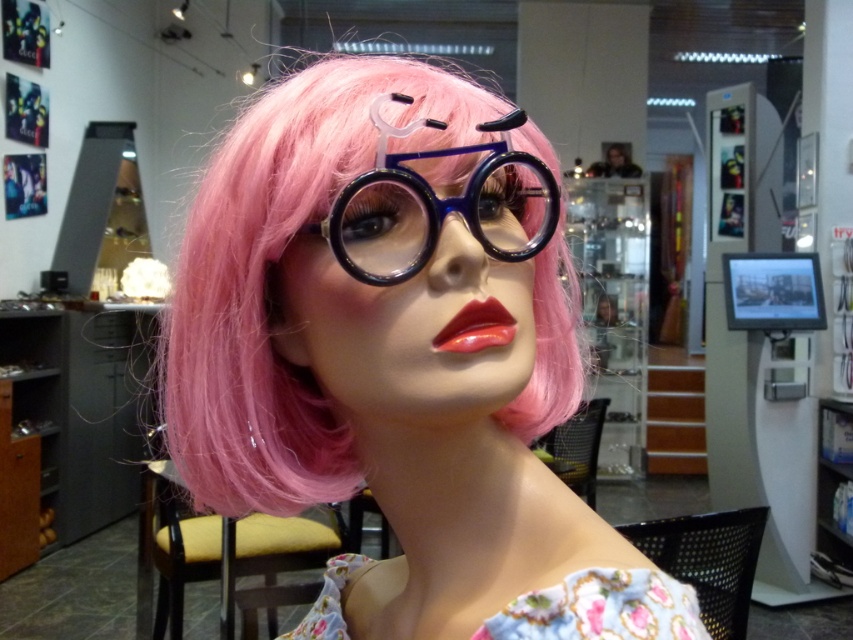
You are a makeup artist trying to apply lipstick to the mannequin. The translucent plastic glasses at center are blocking your view. Can you adjust the glasses to access the glossy red lips at center?

The translucent plastic glasses at center are closer to the viewer than the glossy red lips at center, so you can move the glasses to reveal the glossy red lips at center for easier application.

You are a stylist preparing to take a photo of the mannequin. You need to adjust the position of the translucent plastic glasses at center and the blue plastic goggles at center so that they are aligned horizontally. Which object should you move to the right to achieve this alignment?

To align the translucent plastic glasses at center and the blue plastic goggles at center horizontally, you should move the translucent plastic glasses at center to the right since it is currently positioned to the left of the blue plastic goggles at center.